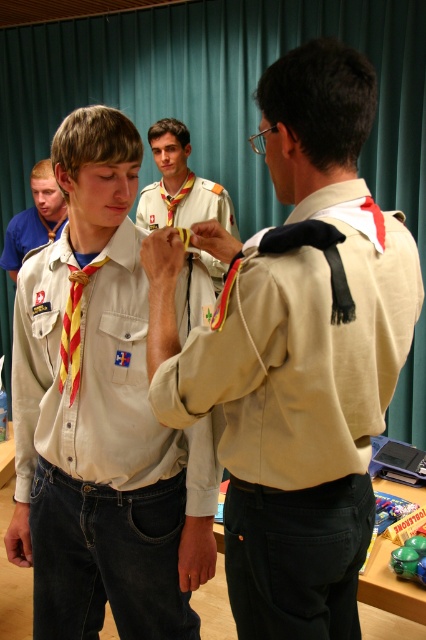
Question: Which object is positioned closest to the matte khaki shirt at center?

Choices:
 (A) yellow/red striped necktie at center
 (B) yellow striped necktie at left
 (C) yellowmaterial/texturetie at center
 (D) beige fabric uniform at center

Answer: (C)

Question: Can you confirm if yellow striped necktie at left is thinner than yellow/red striped tie at center?

Choices:
 (A) yes
 (B) no

Answer: (B)

Question: Can you confirm if beige fabric uniform at center is positioned to the right of matte khaki shirt at center?

Choices:
 (A) yes
 (B) no

Answer: (A)

Question: Which point is closer to the camera?

Choices:
 (A) (189, 368)
 (B) (181, 328)
 (C) (184, 307)

Answer: (A)

Question: Which point is farther to the camera?

Choices:
 (A) yellow/red striped tie at center
 (B) beige fabric uniform at center
 (C) yellow striped necktie at left

Answer: (C)

Question: Is yellow/red striped necktie at center to the left of yellowmaterial/texturetie at center from the viewer's perspective?

Choices:
 (A) yes
 (B) no

Answer: (A)